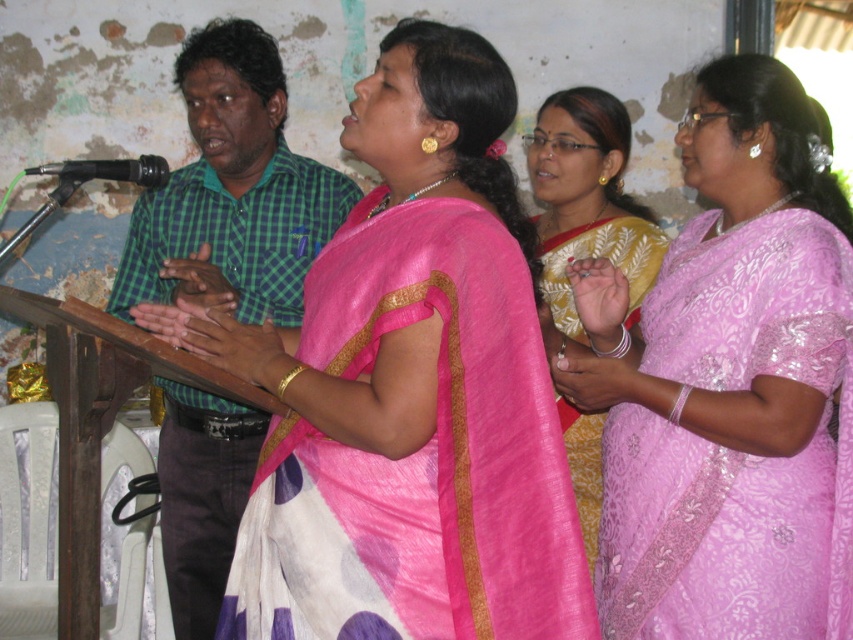
Question: Which object is closer to the camera taking this photo?

Choices:
 (A) yellow silk saree at center
 (B) black matte microphone at left
 (C) pink satin saree at upper right

Answer: (B)

Question: Which point is farther to the camera?

Choices:
 (A) (190, 296)
 (B) (160, 156)

Answer: (A)

Question: Is pink silk saree at center positioned before pink satin saree at upper right?

Choices:
 (A) yes
 (B) no

Answer: (A)

Question: Observing the image, what is the correct spatial positioning of pink satin saree at upper right in reference to black matte microphone at left?

Choices:
 (A) below
 (B) above

Answer: (A)

Question: Can you confirm if green checkered shirt at left is thinner than yellow silk saree at center?

Choices:
 (A) no
 (B) yes

Answer: (A)

Question: Based on their relative distances, which object is nearer to the pink satin saree at upper right?

Choices:
 (A) yellow silk saree at center
 (B) black matte microphone at left
 (C) pink silk saree at center

Answer: (A)